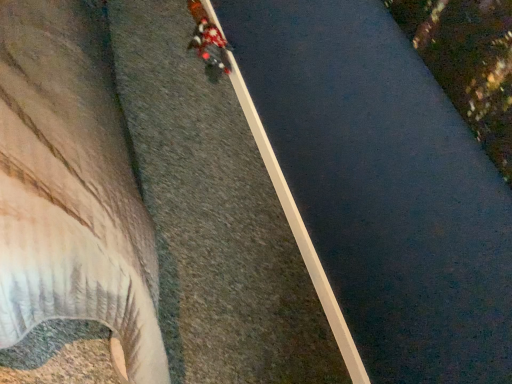
The image size is (512, 384). Identify the location of empty space that is in between smooth concrete waterway at center and red fabric jacket at upper center. (253, 167).